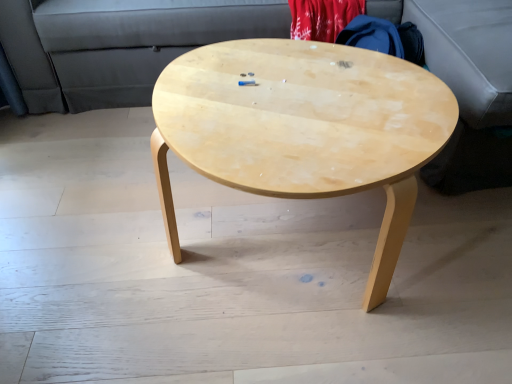
This screenshot has width=512, height=384. Find the location of `free space above natural wood coffee table at center (from a real-world perspective)`. free space above natural wood coffee table at center (from a real-world perspective) is located at coordinates (305, 97).